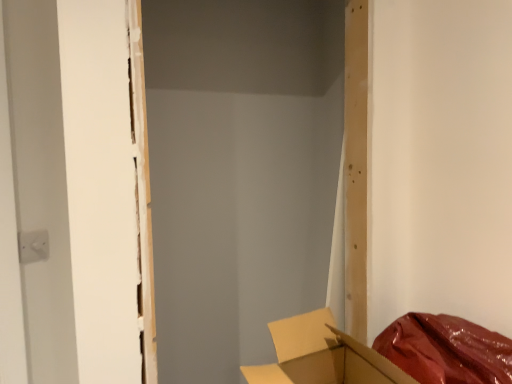
Measure the distance between white plastic electric outlet at left and camera.

The depth of white plastic electric outlet at left is 1.21 meters.

The image size is (512, 384). What do you see at coordinates (33, 246) in the screenshot?
I see `white plastic electric outlet at left` at bounding box center [33, 246].

Image resolution: width=512 pixels, height=384 pixels. Identify the location of white plastic electric outlet at left. (33, 246).

Where is `white plastic electric outlet at left`? Image resolution: width=512 pixels, height=384 pixels. white plastic electric outlet at left is located at coordinates (33, 246).